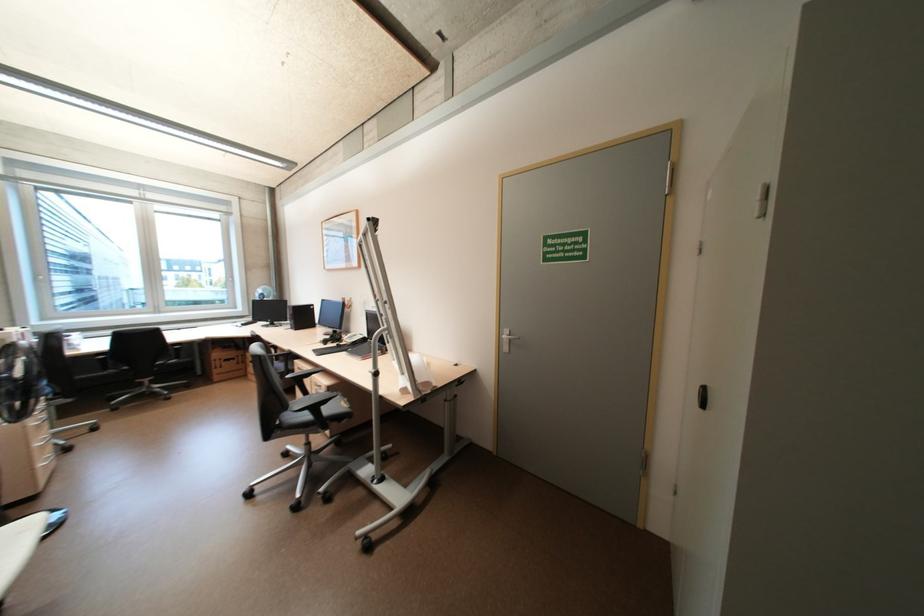
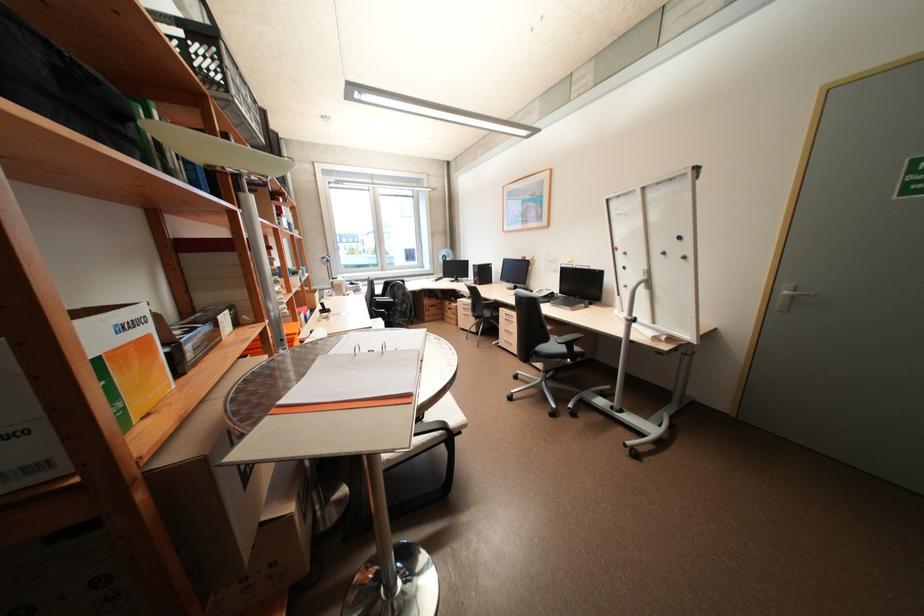
What movement of the cameraman would produce the second image?

The cameraman walked toward left, backward.